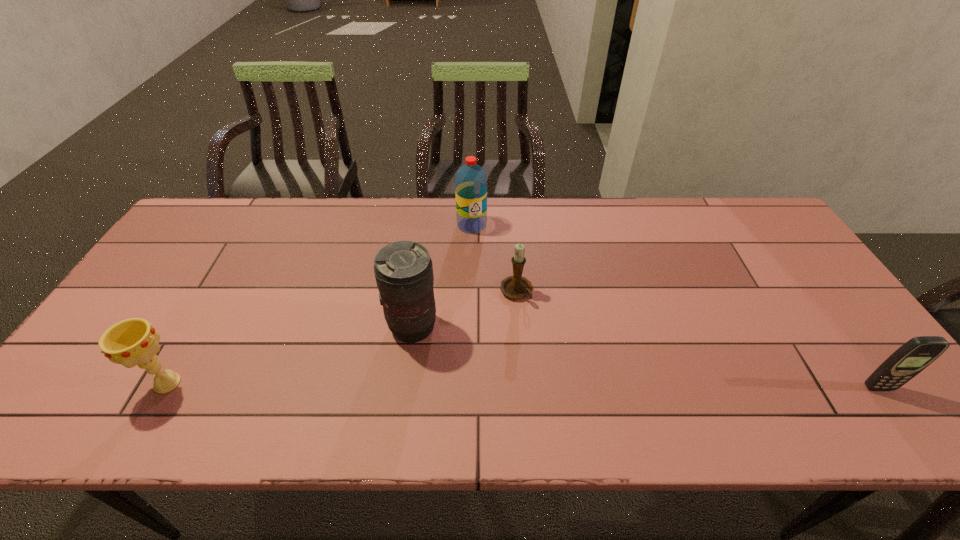
Image resolution: width=960 pixels, height=540 pixels. Identify the location of blank space located 0.240m on the front label of the water bottle. (480, 289).

The height and width of the screenshot is (540, 960). Find the location of `vacant space located on the front label of the water bottle`. vacant space located on the front label of the water bottle is located at coordinates (477, 267).

The width and height of the screenshot is (960, 540). I want to click on free space located 0.210m on the side of the third nearest object where the control switches are located, so click(x=491, y=394).

Identify the location of free location located 0.160m on the side of the third nearest object where the control switches are located. (475, 381).

Identify the location of free space located on the side of the third nearest object where the control switches are located. (463, 370).

Locate an element on the screen. blank space located 0.110m on the side of the fourth nearest object with the handle is located at coordinates (542, 336).

The width and height of the screenshot is (960, 540). Find the location of `blank area located on the side of the fourth nearest object with the handle`. blank area located on the side of the fourth nearest object with the handle is located at coordinates tap(542, 336).

Locate an element on the screen. vacant space located on the side of the fourth nearest object with the handle is located at coordinates (570, 381).

Identify the location of object positioned at the far edge. The image size is (960, 540). (470, 180).

Locate an element on the screen. chalice situated at the near edge is located at coordinates point(130,342).